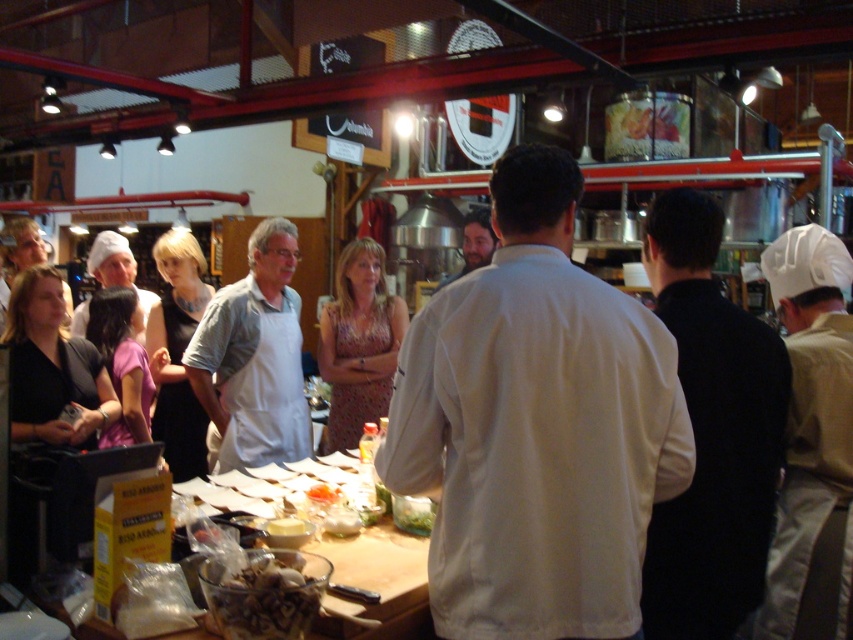
Question: Which of the following is the farthest from the observer?

Choices:
 (A) (426, 528)
 (B) (843, 310)
 (C) (212, 593)

Answer: (B)

Question: Considering the real-world distances, which object is farthest from the black matte apron at center?

Choices:
 (A) dark brown glossy mushrooms at lower center
 (B) white apron at center
 (C) beige fabric chef hat at center
 (D) white smooth shirt at center

Answer: (C)

Question: Estimate the real-world distances between objects in this image. Which object is closer to the white fabric chef hat at right?

Choices:
 (A) matte white chef hat at upper left
 (B) white apron at center
 (C) black matte apron at center

Answer: (C)

Question: Is white smooth shirt at center thinner than white chef hat at center?

Choices:
 (A) no
 (B) yes

Answer: (A)

Question: Is black matte apron at center closer to the viewer compared to white creamy cheese at center?

Choices:
 (A) yes
 (B) no

Answer: (A)

Question: Can you confirm if black matte apron at center is bigger than white creamy cheese at center?

Choices:
 (A) yes
 (B) no

Answer: (A)